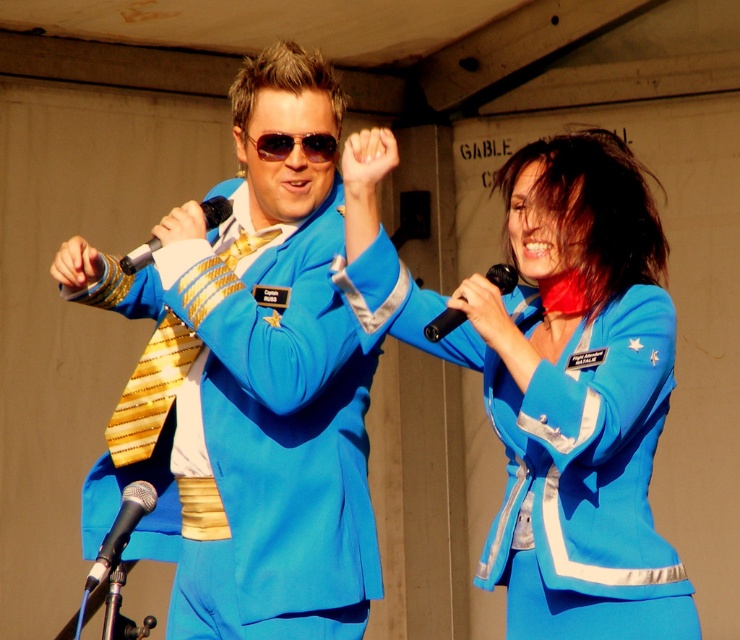
You are an event organizer who needs to arrange a photo shoot. You have a matte blue suit at center and a black plastic microphone at center. Which object should you place on a higher shelf to ensure visibility during the shoot?

The matte blue suit at center is much taller than the black plastic microphone at center, so it should be placed on a higher shelf to ensure visibility during the shoot.

Based on the scene description, where is the blue satin suit at center located in terms of its 2D coordinates?

The blue satin suit at center is located at the 2D coordinates of point (554,378).

You are a stage manager checking the stage setup. You notice two performers wearing the matte blue suit at center and the blue satin suit at center. Which performer should you adjust the microphone stand height for to ensure it reaches their mouth level?

The matte blue suit at center has a greater height compared to blue satin suit at center, so you should adjust the microphone stand to a higher position for the performer in the matte blue suit at center to reach their mouth level.